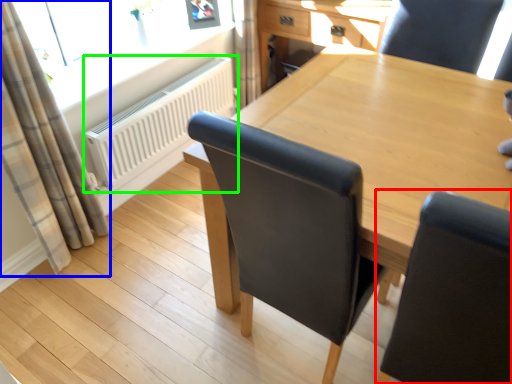
Question: Which object is the farthest from chair (highlighted by a red box)? Choose among these: curtain (highlighted by a blue box) or radiator (highlighted by a green box).

Choices:
 (A) curtain
 (B) radiator

Answer: (B)